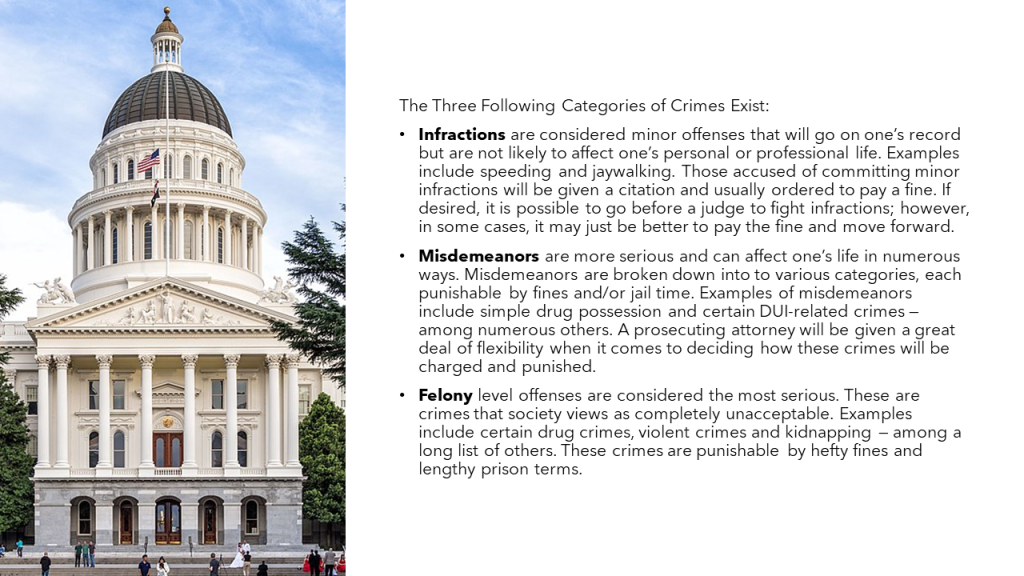
Locate an element on the screen. The width and height of the screenshot is (1024, 576). pillar is located at coordinates (267, 397), (227, 407), (187, 434), (141, 365), (97, 420), (59, 416), (40, 418), (291, 415).